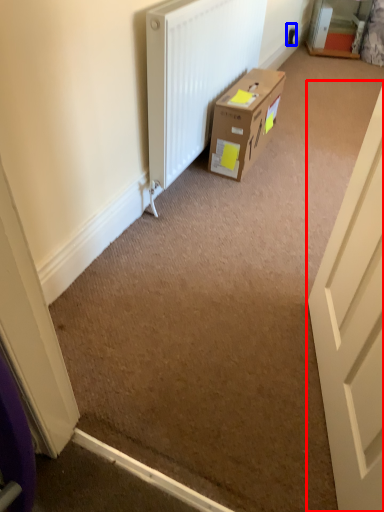
Question: Which of the following is the farthest to the observer, door (highlighted by a red box) or electric outlet (highlighted by a blue box)?

Choices:
 (A) door
 (B) electric outlet

Answer: (B)